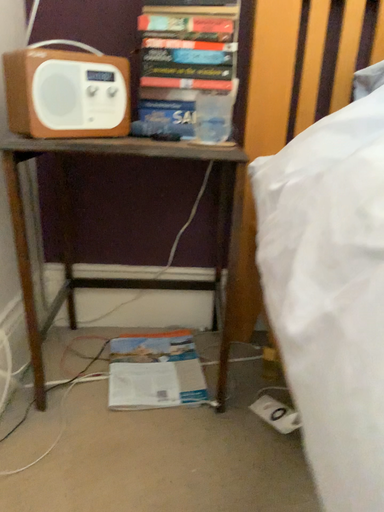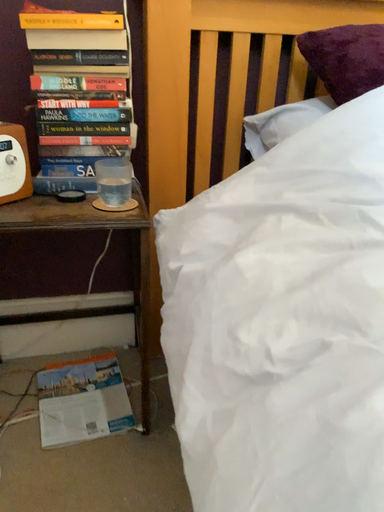
Question: How did the camera likely rotate when shooting the video?

Choices:
 (A) rotated left
 (B) rotated right

Answer: (B)